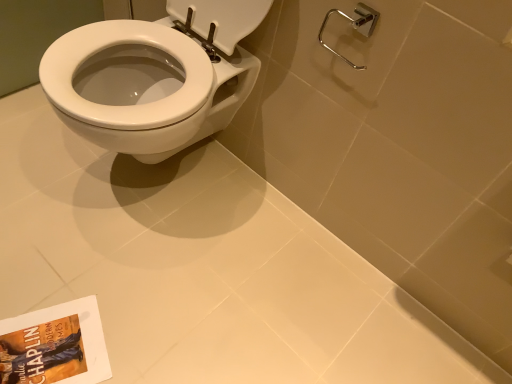
Question: From the image's perspective, is matte paper book at lower left beneath polished chrome shower at upper right?

Choices:
 (A) yes
 (B) no

Answer: (A)

Question: Is matte paper book at lower left wider than polished chrome shower at upper right?

Choices:
 (A) no
 (B) yes

Answer: (B)

Question: From a real-world perspective, is matte paper book at lower left positioned over polished chrome shower at upper right based on gravity?

Choices:
 (A) yes
 (B) no

Answer: (B)

Question: Does matte paper book at lower left have a larger size compared to polished chrome shower at upper right?

Choices:
 (A) yes
 (B) no

Answer: (B)

Question: From a real-world perspective, is matte paper book at lower left physically below polished chrome shower at upper right?

Choices:
 (A) yes
 (B) no

Answer: (A)

Question: Is matte paper book at lower left looking in the opposite direction of polished chrome shower at upper right?

Choices:
 (A) no
 (B) yes

Answer: (A)

Question: Would you say matte paper book at lower left is part of polished chrome shower at upper right's contents?

Choices:
 (A) yes
 (B) no

Answer: (B)

Question: Does polished chrome shower at upper right come in front of matte paper book at lower left?

Choices:
 (A) yes
 (B) no

Answer: (A)

Question: From the image's perspective, is polished chrome shower at upper right under matte paper book at lower left?

Choices:
 (A) no
 (B) yes

Answer: (A)

Question: Considering the relative sizes of polished chrome shower at upper right and matte paper book at lower left in the image provided, is polished chrome shower at upper right shorter than matte paper book at lower left?

Choices:
 (A) no
 (B) yes

Answer: (A)

Question: Is polished chrome shower at upper right taller than matte paper book at lower left?

Choices:
 (A) no
 (B) yes

Answer: (B)

Question: Is polished chrome shower at upper right at the left side of matte paper book at lower left?

Choices:
 (A) yes
 (B) no

Answer: (B)

Question: In terms of width, does matte paper book at lower left look wider or thinner when compared to polished chrome shower at upper right?

Choices:
 (A) wide
 (B) thin

Answer: (A)